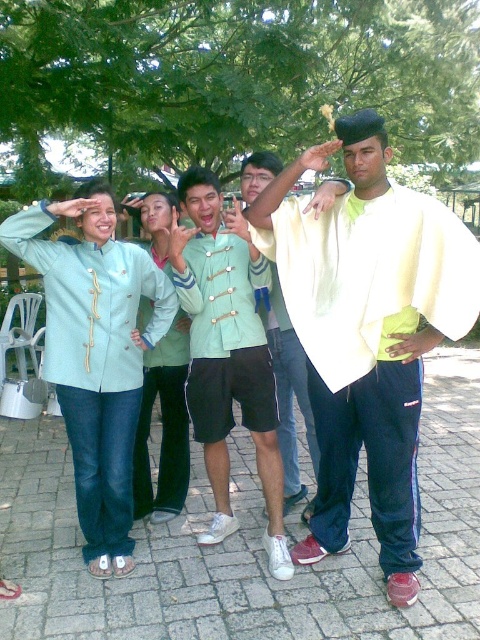
Does matte green uniform at center have a greater height compared to light green fabric shirt at center?

Correct, matte green uniform at center is much taller as light green fabric shirt at center.

The width and height of the screenshot is (480, 640). In order to click on matte green uniform at center in this screenshot , I will do `click(227, 353)`.

Can you confirm if matte green uniform at center is positioned to the right of light blue denim jacket at center?

Yes, matte green uniform at center is to the right of light blue denim jacket at center.

Can you confirm if matte green uniform at center is shorter than light blue denim jacket at center?

Incorrect, matte green uniform at center's height does not fall short of light blue denim jacket at center's.

The height and width of the screenshot is (640, 480). I want to click on matte green uniform at center, so click(227, 353).

Image resolution: width=480 pixels, height=640 pixels. Describe the element at coordinates (368, 332) in the screenshot. I see `light yellow fabric shirt at center` at that location.

Does point (444, 241) lie behind point (101, 320)?

No, it is in front of (101, 320).

Is point (406, 278) positioned behind point (108, 324)?

No, (406, 278) is in front of (108, 324).

Locate an element on the screen. This screenshot has height=640, width=480. light yellow fabric shirt at center is located at coordinates (368, 332).